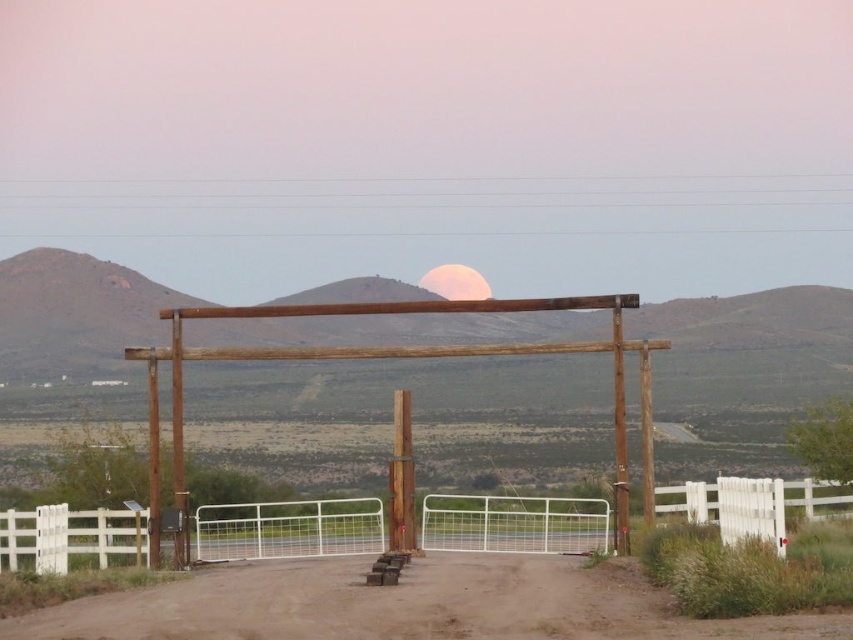
Question: Estimate the real-world distances between objects in this image. Which object is closer to the brown wooden pergola at center?

Choices:
 (A) dirt track at center
 (B) white metal fence at center
 (C) pink matte moon at upper center

Answer: (B)

Question: Does dirt track at center appear over pink matte moon at upper center?

Choices:
 (A) no
 (B) yes

Answer: (A)

Question: Is white metal fence at center below brown wooden pergola at center?

Choices:
 (A) yes
 (B) no

Answer: (A)

Question: Which point appears closest to the camera in this image?

Choices:
 (A) (645, 499)
 (B) (103, 632)

Answer: (B)

Question: Does dirt track at center appear under pink matte moon at upper center?

Choices:
 (A) no
 (B) yes

Answer: (B)

Question: Among these objects, which one is farthest from the camera?

Choices:
 (A) dirt track at center
 (B) pink matte moon at upper center
 (C) brown wooden pergola at center

Answer: (B)